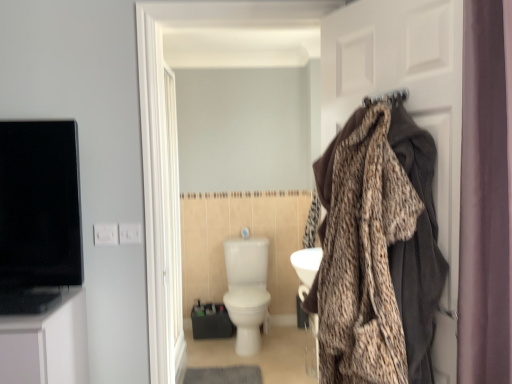
In order to face purple fabric curtain at right, should I rotate leftwards or rightwards?

To align with it, rotate right about 29.346°.

This screenshot has width=512, height=384. Identify the location of brown fabric coat at right. (407, 109).

Between brown fabric coat at right and white glossy toilet at center, which one has less height?

white glossy toilet at center.

Which object is positioned more to the right, brown fabric coat at right or white glossy toilet at center?

From the viewer's perspective, brown fabric coat at right appears more on the right side.

Image resolution: width=512 pixels, height=384 pixels. I want to click on door that appears on the right of white glossy toilet at center, so click(407, 109).

Is white glossy toilet at center aimed at purple fabric curtain at right?

No, white glossy toilet at center does not turn towards purple fabric curtain at right.

Relative to purple fabric curtain at right, is white glossy toilet at center in front or behind?

Visually, white glossy toilet at center is located behind purple fabric curtain at right.

From the image's perspective, who appears lower, white glossy toilet at center or purple fabric curtain at right?

From the image's view, white glossy toilet at center is below.

Based on the photo, which is behind, white glossy door at center or leopard print blanket at right?

white glossy door at center is behind.

Between white glossy door at center and leopard print blanket at right, which one has more height?

Standing taller between the two is white glossy door at center.

Is white glossy door at center at the left side of leopard print blanket at right?

Yes, white glossy door at center is to the left of leopard print blanket at right.

From a real-world perspective, is white glossy door at center below leopard print blanket at right?

Yes, from a real-world perspective, white glossy door at center is beneath leopard print blanket at right.

Is white glossy door at center completely or partially outside of white glossy toilet at center?

Absolutely, white glossy door at center is external to white glossy toilet at center.

Is white glossy door at center facing towards white glossy toilet at center?

No, white glossy door at center is not aimed at white glossy toilet at center.

Can you confirm if white glossy door at center is smaller than white glossy toilet at center?

Yes.

Which object is further away from the camera, white glossy door at center or white glossy toilet at center?

white glossy toilet at center is more distant.

In the scene shown: Is white glossy door at center oriented towards purple fabric curtain at right?

No, white glossy door at center is not oriented towards purple fabric curtain at right.

From the image's perspective, is white glossy door at center located above purple fabric curtain at right?

No, from the image's perspective, white glossy door at center is not on top of purple fabric curtain at right.

Considering the positions of objects white glossy door at center and purple fabric curtain at right in the image provided, who is in front, white glossy door at center or purple fabric curtain at right?

purple fabric curtain at right is closer to the camera.

Which object is positioned more to the right, purple fabric curtain at right or brown fabric coat at right?

purple fabric curtain at right.

Are purple fabric curtain at right and brown fabric coat at right far apart?

No.

Does purple fabric curtain at right have a lesser height compared to brown fabric coat at right?

Indeed, purple fabric curtain at right has a lesser height compared to brown fabric coat at right.

Does point (472, 100) come farther from viewer compared to point (373, 4)?

No.

Does point (504, 220) come farther from viewer compared to point (253, 295)?

No, it is not.

Is purple fabric curtain at right not inside white glossy toilet at center?

Yes, purple fabric curtain at right is outside of white glossy toilet at center.

Is purple fabric curtain at right oriented towards white glossy toilet at center?

No, purple fabric curtain at right is not aimed at white glossy toilet at center.

The height and width of the screenshot is (384, 512). Find the location of `toilet that appears on the left of brown fabric coat at right`. toilet that appears on the left of brown fabric coat at right is located at coordinates (247, 290).

You are a GUI agent. You are given a task and a screenshot of the screen. Output one action in this format:
    pyautogui.click(x=<x>, y=<y>)
    Task: Click on the curtain that appears in front of the white glossy toilet at center
    
    Given the screenshot: What is the action you would take?
    pyautogui.click(x=486, y=195)

Which object lies further to the anchor point leopard print blanket at right, purple fabric curtain at right or white glossy toilet at center?

white glossy toilet at center is positioned further to the anchor leopard print blanket at right.

From the picture: Considering their positions, is white glossy door at center positioned further to leopard print blanket at right than purple fabric curtain at right?

white glossy door at center is further to leopard print blanket at right.

Which object lies nearer to the anchor point brown fabric coat at right, white glossy toilet at center or white glossy door at center?

white glossy door at center is closer to brown fabric coat at right.

When comparing their distances from white glossy toilet at center, does leopard print blanket at right or white glossy door at center seem closer?

white glossy door at center is closer to white glossy toilet at center.

From the image, which object appears to be farther from leopard print blanket at right, brown fabric coat at right or purple fabric curtain at right?

Based on the image, purple fabric curtain at right appears to be further to leopard print blanket at right.

Which object lies further to the anchor point white glossy door at center, leopard print blanket at right or white glossy toilet at center?

leopard print blanket at right is further to white glossy door at center.

Which object lies further to the anchor point leopard print blanket at right, white glossy door at center or brown fabric coat at right?

The object further to leopard print blanket at right is white glossy door at center.

Which object lies nearer to the anchor point white glossy door at center, brown fabric coat at right or white glossy toilet at center?

white glossy toilet at center.

Identify the location of screen door between leopard print blanket at right and white glossy toilet at center in the front-back direction. (173, 232).

Locate an element on the screen. The width and height of the screenshot is (512, 384). blanket located between purple fabric curtain at right and white glossy door at center in the depth direction is located at coordinates (417, 246).

Identify the location of screen door between brown fabric coat at right and white glossy toilet at center from front to back. The image size is (512, 384). (173, 232).

What are the coordinates of `screen door located between purple fabric curtain at right and white glossy toilet at center in the depth direction` in the screenshot? It's located at point(173,232).